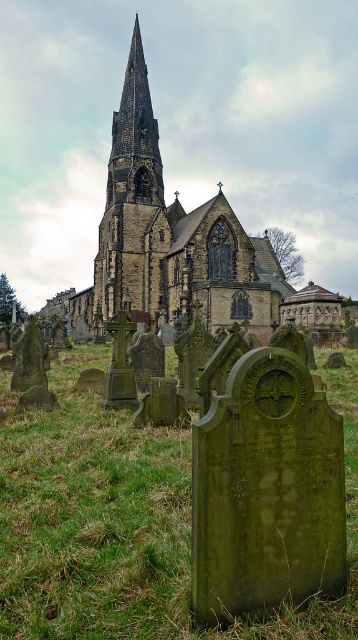
Question: Which of the following is the closest to the observer?

Choices:
 (A) dark stone church at center
 (B) brown stone tower at center

Answer: (A)

Question: Is green mossy gravestone at center smaller than brown stone tower at center?

Choices:
 (A) no
 (B) yes

Answer: (B)

Question: Which object appears farthest from the camera in this image?

Choices:
 (A) green mossy gravestone at center
 (B) brown stone tower at center

Answer: (B)

Question: Which of the following is the farthest from the observer?

Choices:
 (A) (117, 268)
 (B) (37, 490)
 (C) (142, 172)

Answer: (C)

Question: Can you confirm if green mossy gravestone at center is positioned below brown stone tower at center?

Choices:
 (A) yes
 (B) no

Answer: (A)

Question: In this image, where is green mossy gravestone at center located relative to brown stone tower at center?

Choices:
 (A) below
 (B) above

Answer: (A)